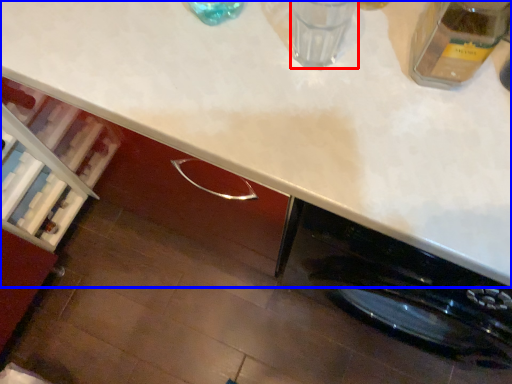
Question: Which object appears farthest to the camera in this image, water (highlighted by a red box) or countertop (highlighted by a blue box)?

Choices:
 (A) water
 (B) countertop

Answer: (A)